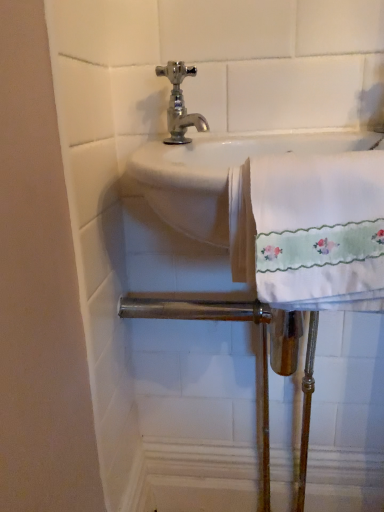
This screenshot has width=384, height=512. Identify the location of free location to the right of chrome/metallic faucet at upper center. (278, 137).